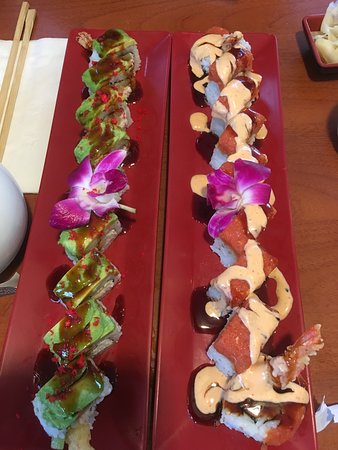
Find the location of a particular element. This screenshot has width=338, height=450. trays is located at coordinates (140, 306), (182, 255).